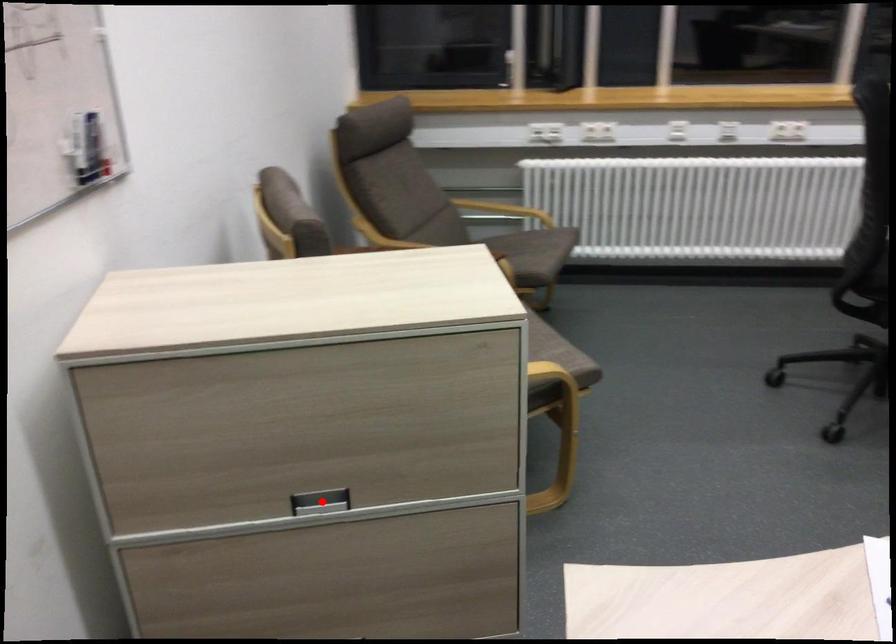
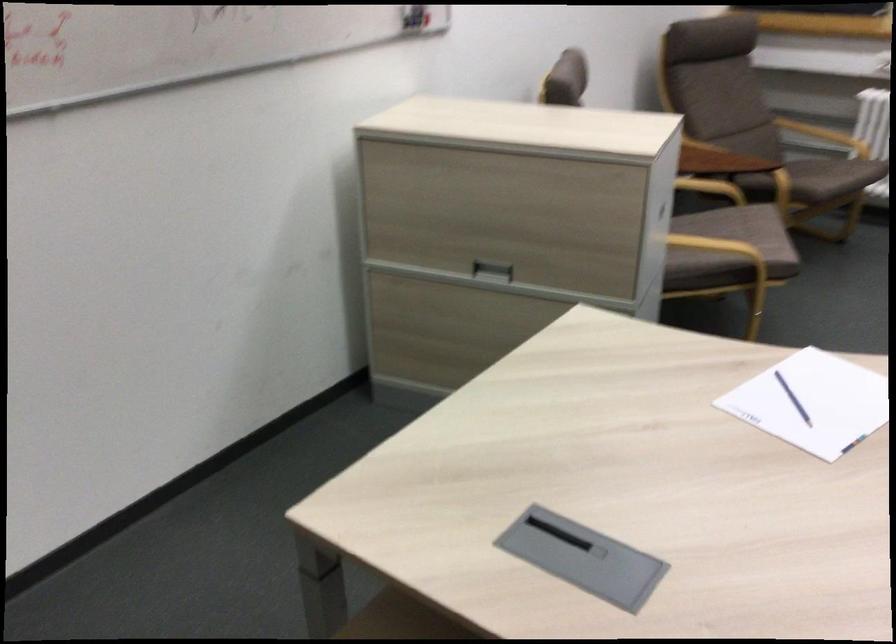
Question: I am providing you with two images of the same scene from different viewpoints. A red point is shown in image1. For the corresponding object point in image2, is it positioned nearer or farther from the camera?

Choices:
 (A) Nearer
 (B) Farther

Answer: (B)